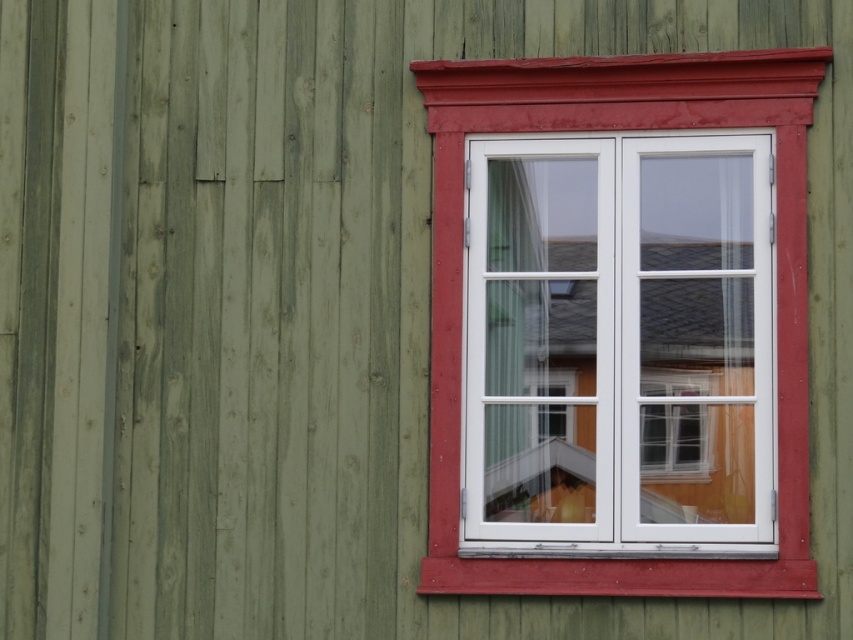
Question: Which object is closer to the camera taking this photo?

Choices:
 (A) white sheer curtain at center
 (B) matte white window frame at center

Answer: (B)

Question: Does matte white window frame at center appear on the right side of white sheer curtain at center?

Choices:
 (A) no
 (B) yes

Answer: (B)

Question: Is matte white window frame at center to the left of white sheer curtain at center from the viewer's perspective?

Choices:
 (A) yes
 (B) no

Answer: (B)

Question: Which point is farther to the camera?

Choices:
 (A) [434, 262]
 (B) [515, 205]

Answer: (B)

Question: Considering the relative positions of matte white window frame at center and white sheer curtain at center in the image provided, where is matte white window frame at center located with respect to white sheer curtain at center?

Choices:
 (A) below
 (B) above

Answer: (B)